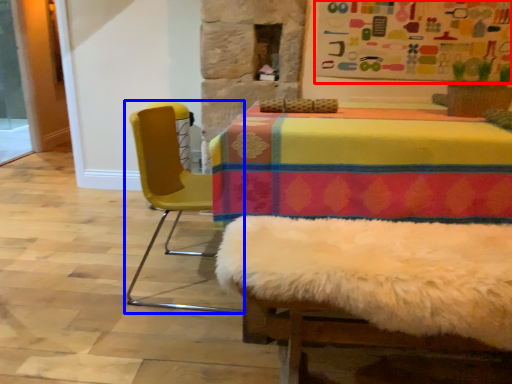
Question: Which point is closer to the camera, bulletin board (highlighted by a red box) or chair (highlighted by a blue box)?

Choices:
 (A) bulletin board
 (B) chair

Answer: (B)